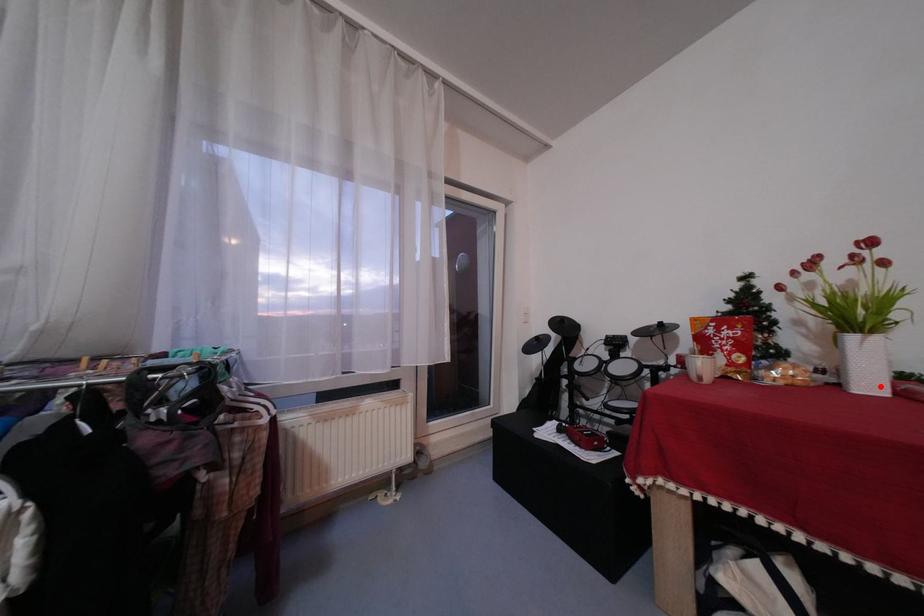
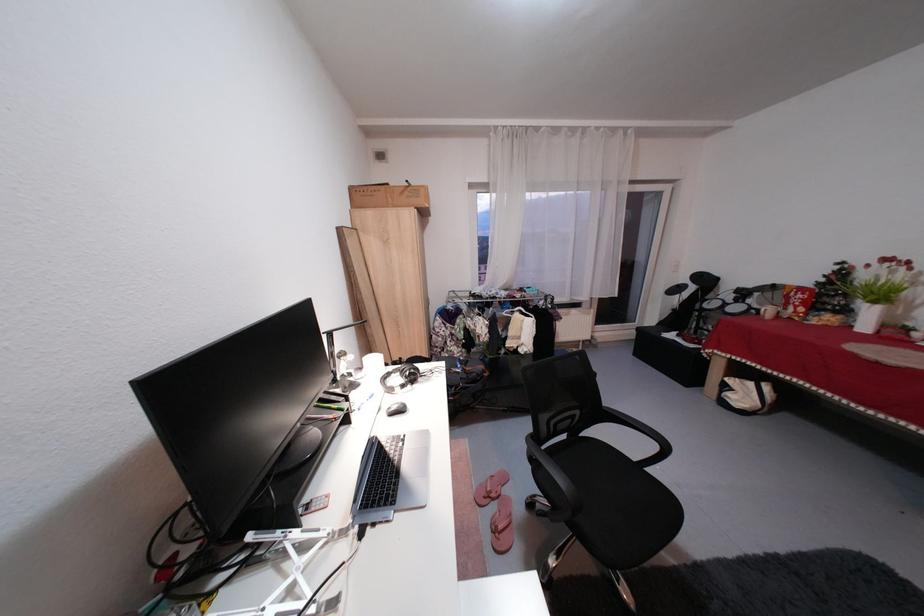
Question: I am providing you with two images of the same scene from different viewpoints. In image1, a red point is highlighted. Considering the same 3D point in image2, which of the following is correct?

Choices:
 (A) It is closer
 (B) It is farther

Answer: (B)